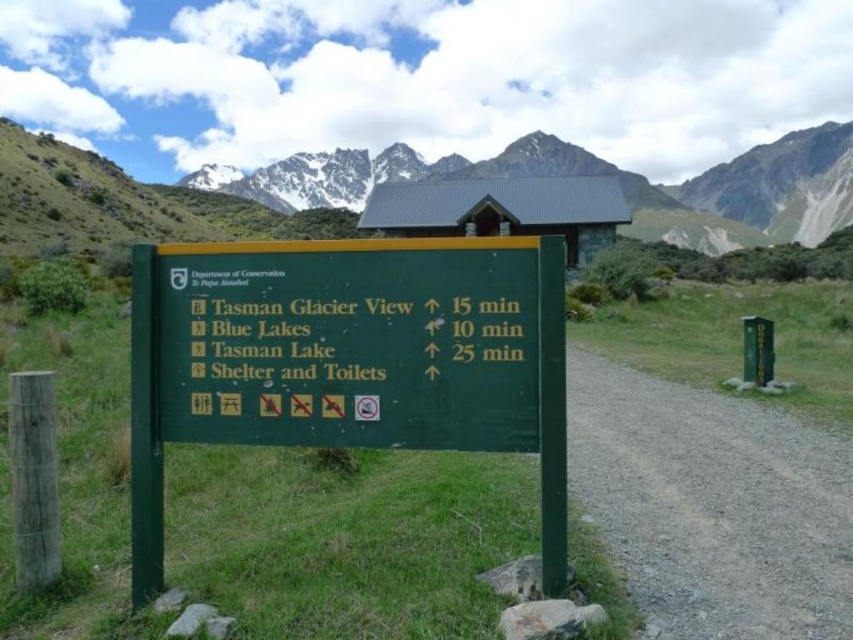
Question: Which object is farther from the camera taking this photo?

Choices:
 (A) snowy granite mountain at upper center
 (B) green matte sign at center

Answer: (A)

Question: Is the position of green matte sign at center less distant than that of snowy granite mountain at upper center?

Choices:
 (A) yes
 (B) no

Answer: (A)

Question: Is green matte sign at center bigger than snowy granite mountain at upper center?

Choices:
 (A) no
 (B) yes

Answer: (A)

Question: Which point is closer to the camera?

Choices:
 (A) (242, 202)
 (B) (547, 483)

Answer: (B)

Question: Does green matte sign at center appear on the right side of snowy granite mountain at upper center?

Choices:
 (A) yes
 (B) no

Answer: (B)